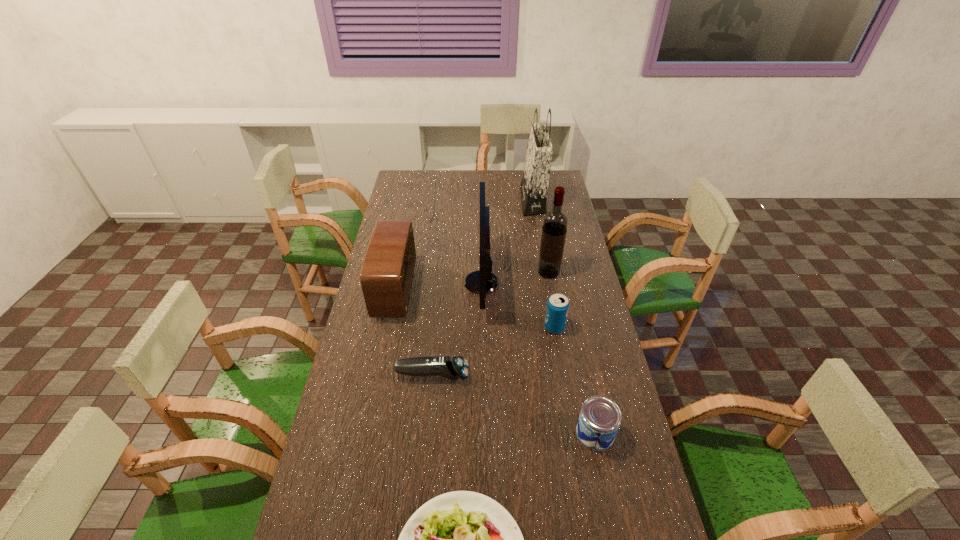
Image resolution: width=960 pixels, height=540 pixels. In order to click on vacant space situated on the front label of the third shortest object in this screenshot , I will do `click(449, 433)`.

Identify the location of free location located on the front label of the third shortest object. This screenshot has height=540, width=960. (552, 433).

Where is `vacant space located 0.150m on the head of the sixth farthest object`? vacant space located 0.150m on the head of the sixth farthest object is located at coordinates (516, 375).

Where is `object present at the far edge`? The image size is (960, 540). object present at the far edge is located at coordinates (534, 185).

Find the location of a particular element. This screenshot has height=540, width=960. object situated at the left edge is located at coordinates (386, 277).

The image size is (960, 540). Find the location of `shopping bag positioned at the right edge`. shopping bag positioned at the right edge is located at coordinates (534, 185).

Locate an element on the screen. The image size is (960, 540). wine bottle that is at the right edge is located at coordinates (555, 222).

I want to click on soda can that is at the right edge, so click(x=557, y=308).

This screenshot has width=960, height=540. I want to click on can that is at the right edge, so click(600, 417).

Where is `object present at the far right corner`? The width and height of the screenshot is (960, 540). object present at the far right corner is located at coordinates (534, 185).